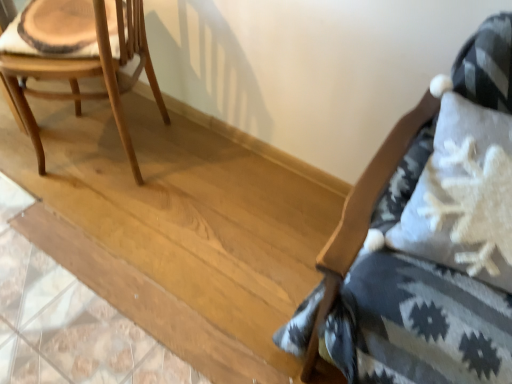
Question: Is textured gray cushion at right, acting as the second chair starting from the left, taller or shorter than natural wood chair at left, the second chair viewed from the right?

Choices:
 (A) short
 (B) tall

Answer: (B)

Question: Is point (423, 292) positioned closer to the camera than point (55, 8)?

Choices:
 (A) closer
 (B) farther

Answer: (A)

Question: Which is correct: textured gray cushion at right, the first chair viewed from the right, is inside natural wood chair at left, the second chair viewed from the right, or outside of it?

Choices:
 (A) inside
 (B) outside

Answer: (B)

Question: From the image's perspective, relative to textured gray cushion at right, the first chair viewed from the right, is natural wood chair at left, which ranks as the first chair in left-to-right order, above or below?

Choices:
 (A) above
 (B) below

Answer: (A)

Question: Is natural wood chair at left, the second chair viewed from the right, in front of or behind textured gray cushion at right, acting as the second chair starting from the left, in the image?

Choices:
 (A) behind
 (B) front

Answer: (A)

Question: Looking at the image, does natural wood chair at left, which ranks as the first chair in left-to-right order, seem bigger or smaller compared to textured gray cushion at right, the first chair viewed from the right?

Choices:
 (A) big
 (B) small

Answer: (B)

Question: From a real-world perspective, relative to textured gray cushion at right, the first chair viewed from the right, is natural wood chair at left, the second chair viewed from the right, vertically above or below?

Choices:
 (A) above
 (B) below

Answer: (B)